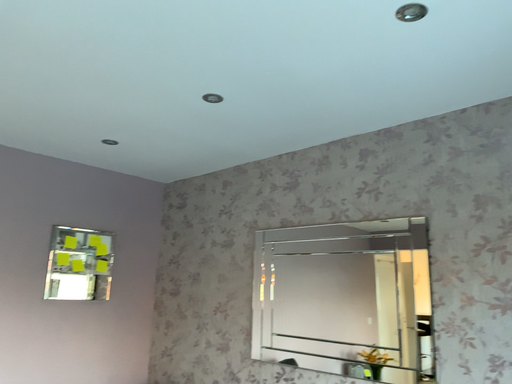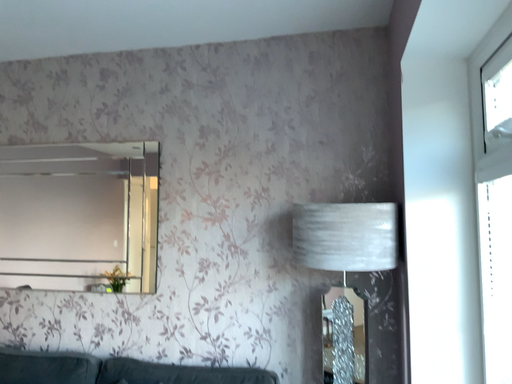
Question: How did the camera likely rotate when shooting the video?

Choices:
 (A) rotated left
 (B) rotated right

Answer: (B)